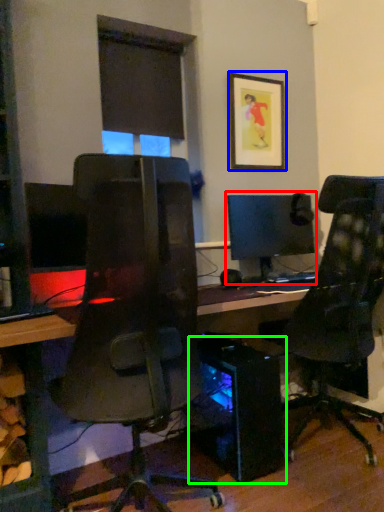
Question: Which object is the farthest from computer monitor (highlighted by a red box)? Choose among these: picture frame (highlighted by a blue box) or computer tower (highlighted by a green box).

Choices:
 (A) picture frame
 (B) computer tower

Answer: (B)